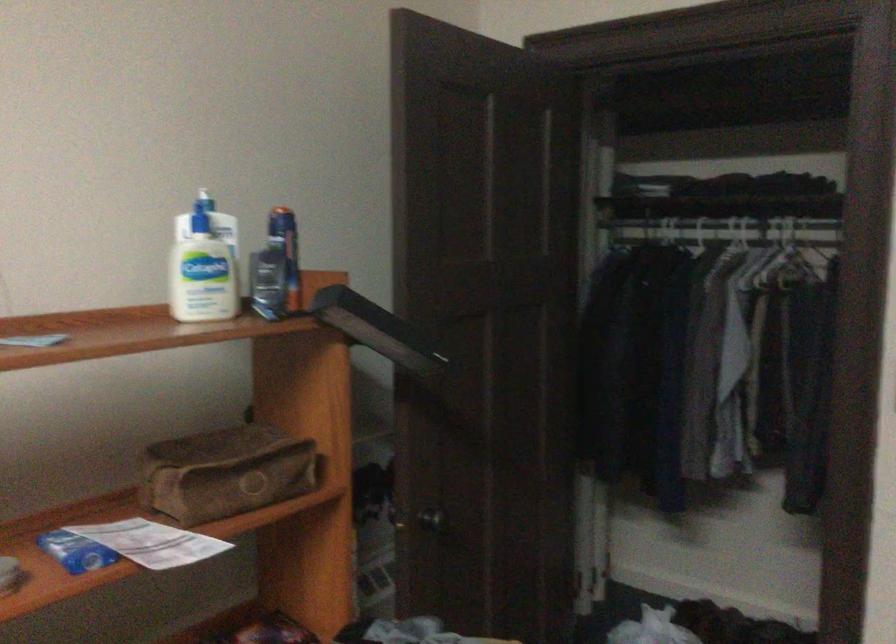
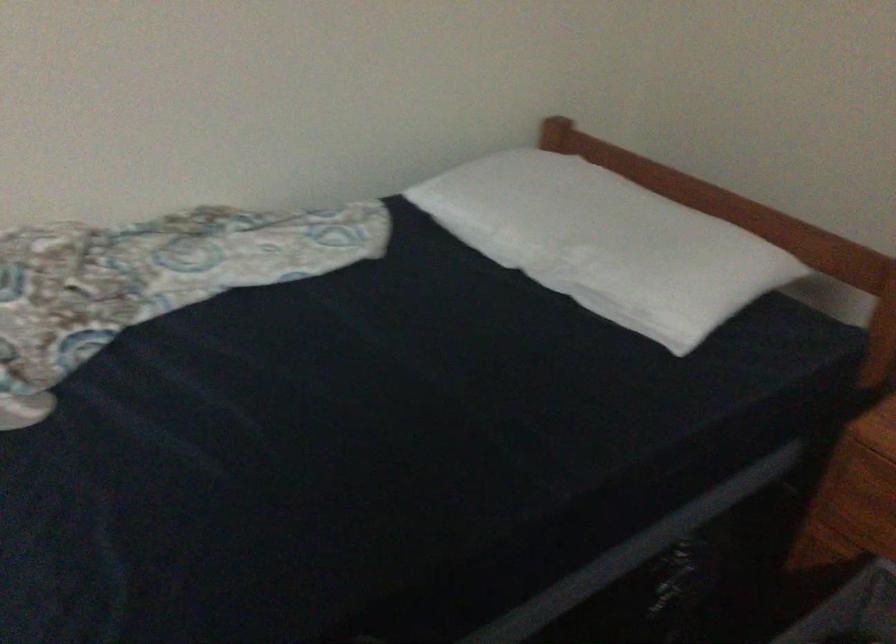
The images are taken continuously from a first-person perspective. In which direction is your viewpoint rotating?

The camera's rotation is toward right-down.